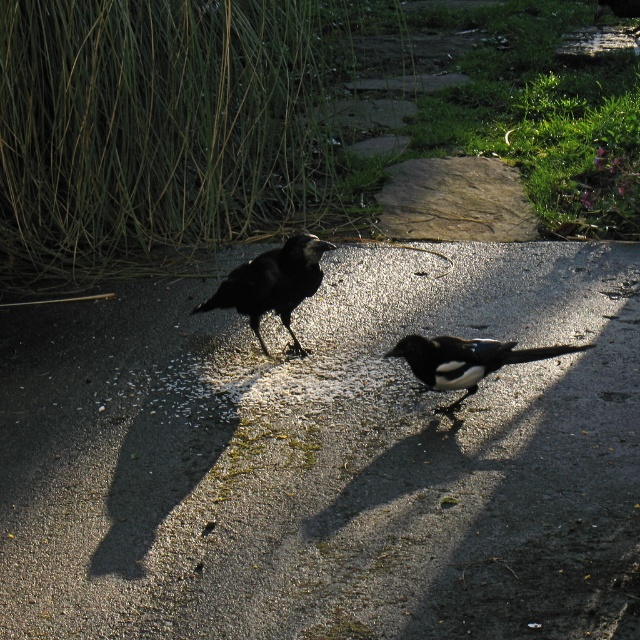
Can you confirm if shiny black crow at center is positioned below white glossy magpie at center?

No, shiny black crow at center is not below white glossy magpie at center.

Locate an element on the screen. The height and width of the screenshot is (640, 640). shiny black crow at center is located at coordinates (273, 284).

Does point (234, 292) come closer to viewer compared to point (484, 374)?

No, (234, 292) is behind (484, 374).

This screenshot has height=640, width=640. In order to click on shiny black crow at center in this screenshot , I will do `click(273, 284)`.

Is glossy asphalt at center positioned at the back of white glossy magpie at center?

No, glossy asphalt at center is in front of white glossy magpie at center.

Consider the image. Who is positioned more to the left, glossy asphalt at center or white glossy magpie at center?

glossy asphalt at center

Who is more forward, (316, 374) or (467, 376)?

Positioned in front is point (467, 376).

At what (x,y) coordinates should I click in order to perform the action: click on glossy asphalt at center. Please return your answer as a coordinate pair (x, y). The width and height of the screenshot is (640, 640). Looking at the image, I should click on (326, 458).

Which is more to the right, glossy asphalt at center or shiny black crow at center?

Positioned to the right is glossy asphalt at center.

Can you confirm if glossy asphalt at center is positioned to the right of shiny black crow at center?

Correct, you'll find glossy asphalt at center to the right of shiny black crow at center.

Does point (465, 298) lie behind point (266, 262)?

That is True.

Find the location of a particular element. The width and height of the screenshot is (640, 640). glossy asphalt at center is located at coordinates (326, 458).